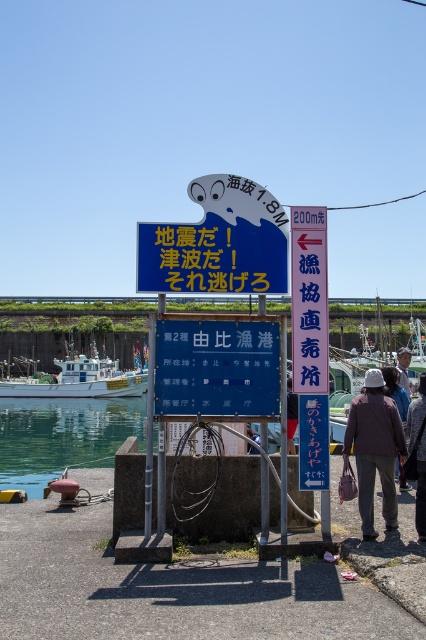
Which is more to the left, clear water at lower left or white hat at center?

From the viewer's perspective, clear water at lower left appears more on the left side.

Can you confirm if clear water at lower left is shorter than white hat at center?

No.

Is point (58, 468) behind point (402, 385)?

Yes, point (58, 468) is behind point (402, 385).

The image size is (426, 640). In order to click on clear water at lower left in this screenshot , I will do `click(63, 436)`.

Looking at this image, is clear water at lower left bigger than blue plastic sign at center?

Indeed, clear water at lower left has a larger size compared to blue plastic sign at center.

Between point (2, 488) and point (291, 260), which one is positioned behind?

The point (2, 488) is more distant.

At what (x,y) coordinates should I click in order to perform the action: click on clear water at lower left. Please return your answer as a coordinate pair (x, y). Image resolution: width=426 pixels, height=640 pixels. Looking at the image, I should click on (63, 436).

Is clear water at lower left above brown matte jacket at center?

Incorrect, clear water at lower left is not positioned above brown matte jacket at center.

Is clear water at lower left wider than brown matte jacket at center?

Correct, the width of clear water at lower left exceeds that of brown matte jacket at center.

The image size is (426, 640). What do you see at coordinates (63, 436) in the screenshot?
I see `clear water at lower left` at bounding box center [63, 436].

This screenshot has height=640, width=426. I want to click on clear water at lower left, so click(x=63, y=436).